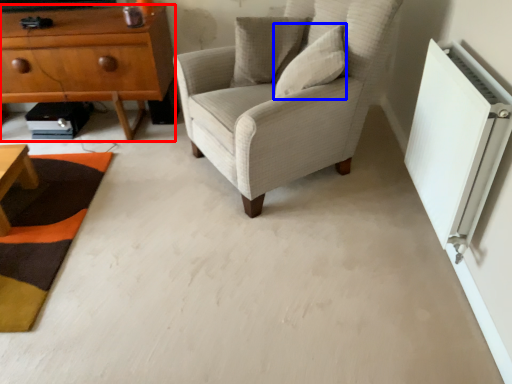
Question: Which point is further to the camera, chest of drawers (highlighted by a red box) or pillow (highlighted by a blue box)?

Choices:
 (A) chest of drawers
 (B) pillow

Answer: (A)